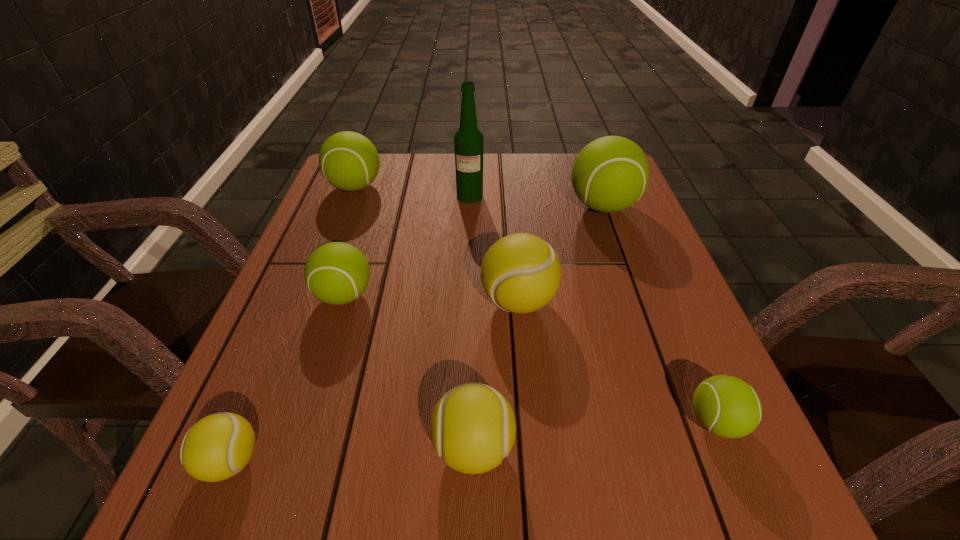
I want to click on object located at the near left corner, so click(x=217, y=447).

Locate an element on the screen. object positioned at the far right corner is located at coordinates (610, 174).

In the image, there is a desktop. Where is `vacant space at the far edge`? This screenshot has height=540, width=960. vacant space at the far edge is located at coordinates (512, 186).

At what (x,y) coordinates should I click in order to perform the action: click on free point at the near edge. Please return your answer as a coordinate pair (x, y). Looking at the image, I should click on (349, 484).

The image size is (960, 540). In order to click on free space at the left edge of the desktop in this screenshot , I will do `click(380, 214)`.

The width and height of the screenshot is (960, 540). What are the coordinates of `vacant space at the right edge of the desktop` in the screenshot? It's located at (620, 231).

You are a GUI agent. You are given a task and a screenshot of the screen. Output one action in this format:
    pyautogui.click(x=<x>, y=<y>)
    Task: Click on the free space at the far left corner
    
    Given the screenshot: What is the action you would take?
    [387, 184]

You are a GUI agent. You are given a task and a screenshot of the screen. Output one action in this format:
    pyautogui.click(x=<x>, y=<y>)
    Task: Click on the free space at the near left corner of the desktop
    This screenshot has height=540, width=960.
    Given the screenshot: What is the action you would take?
    pyautogui.click(x=202, y=507)

I want to click on free space between the smallest green tennis ball and the third farthest green tennis ball, so click(530, 359).

I want to click on vacant space that is in between the biggest yellow tennis ball and the seventh shortest object, so click(x=561, y=254).